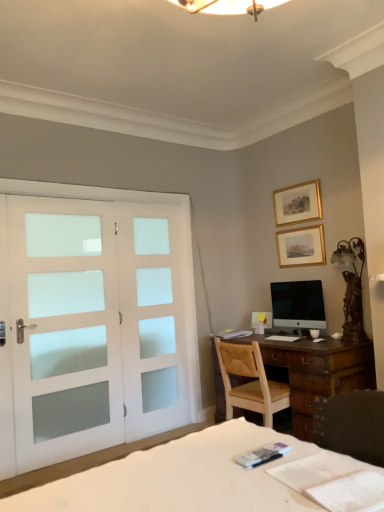
Question: From their relative heights in the image, would you say black glossy monitor at center is taller or shorter than bronze/metallic table lamp at right?

Choices:
 (A) short
 (B) tall

Answer: (A)

Question: From the image's perspective, is black glossy monitor at center located above or below bronze/metallic table lamp at right?

Choices:
 (A) below
 (B) above

Answer: (A)

Question: Estimate the real-world distances between objects in this image. Which object is farther from the white frosted glass doors at left?

Choices:
 (A) gold-framed picture at upper right, which is the 1th picture frame in bottom-to-top order
 (B) white fabric bed at lower left
 (C) black glossy monitor at center
 (D) bronze/metallic table lamp at right
 (E) light brown wooden chair at center

Answer: (B)

Question: Estimate the real-world distances between objects in this image. Which object is farther from the white frosted glass screen door at left?

Choices:
 (A) gold-framed picture at upper right, which is the 1th picture frame in bottom-to-top order
 (B) gold/gilded picture frame at upper center, positioned as the 1th picture frame in top-to-bottom order
 (C) light brown wooden chair at center
 (D) bronze/metallic table lamp at right
 (E) white frosted glass doors at left

Answer: (D)